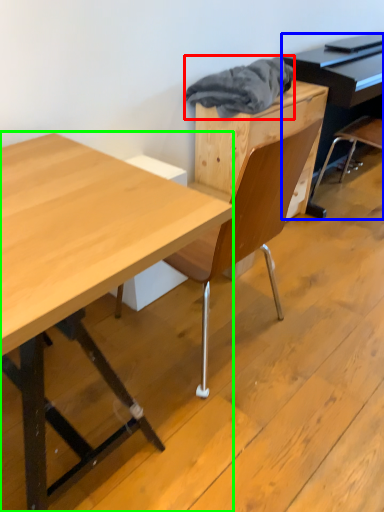
Question: Considering the real-world distances, which object is closest to material (highlighted by a red box)? piano (highlighted by a blue box) or desk (highlighted by a green box).

Choices:
 (A) piano
 (B) desk

Answer: (A)